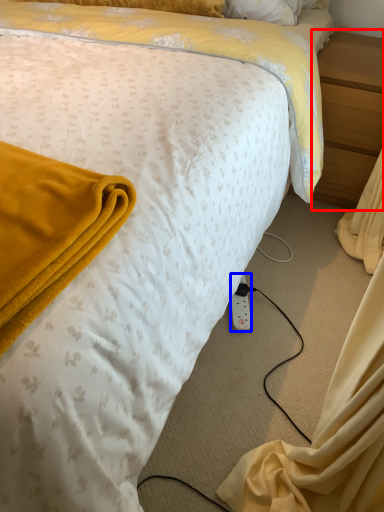
Question: Which of the following is the closest to the observer, nightstand (highlighted by a red box) or power outlet (highlighted by a blue box)?

Choices:
 (A) nightstand
 (B) power outlet

Answer: (B)